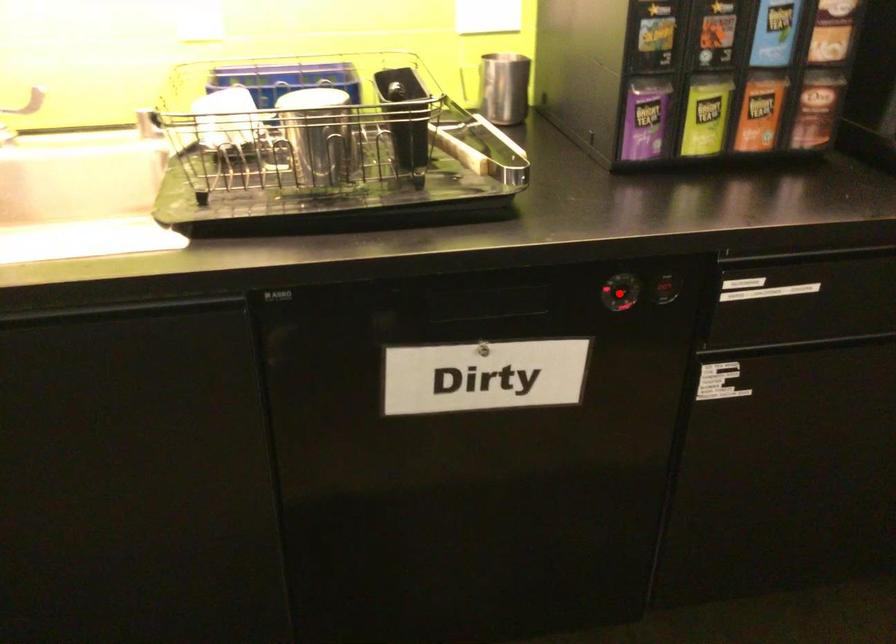
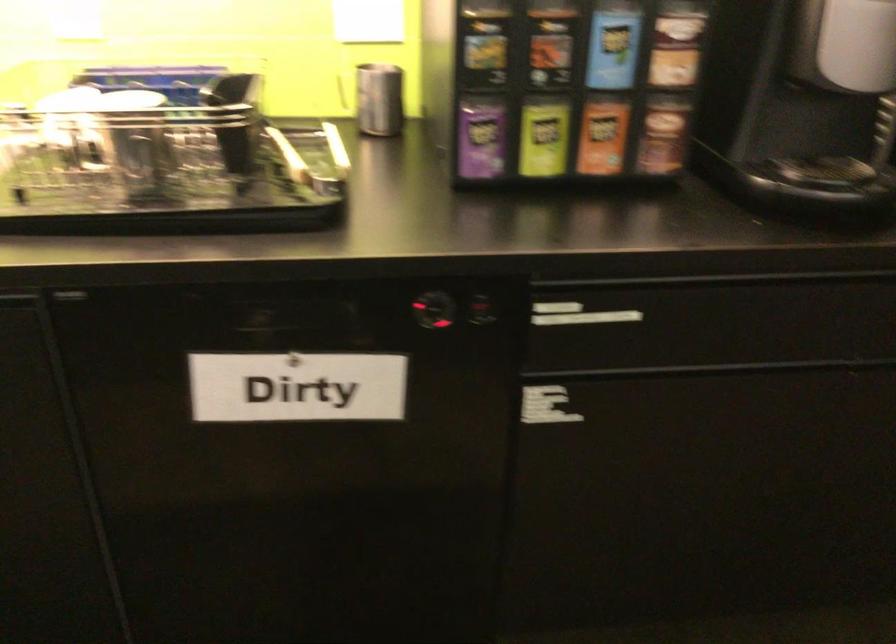
Where in the second image is the point corresponding to the highlighted location from the first image?

(433, 310)